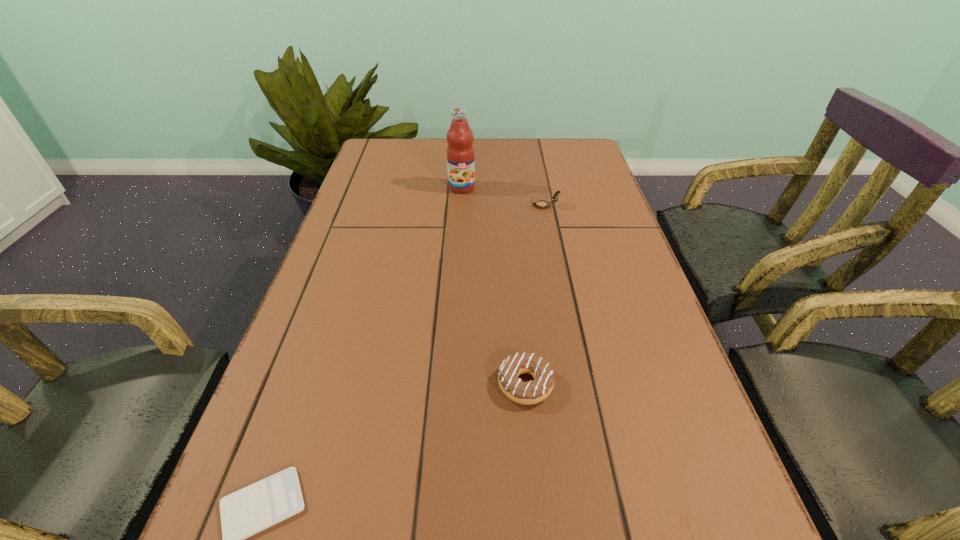
Locate an element on the screen. The image size is (960, 540). blank region between the second object from right to left and the tallest object is located at coordinates (493, 286).

Where is `free space between the tallest object and the second object from right to left`? This screenshot has width=960, height=540. free space between the tallest object and the second object from right to left is located at coordinates (493, 286).

You are a GUI agent. You are given a task and a screenshot of the screen. Output one action in this format:
    pyautogui.click(x=<x>, y=<y>)
    Task: Click on the object that is the second closest one to the farthest object
    The width and height of the screenshot is (960, 540).
    Given the screenshot: What is the action you would take?
    pyautogui.click(x=534, y=391)

Identify which object is the third nearest to the fruit juice. Please provide its 2D coordinates. Your answer should be formatted as a tuple, i.e. [(x, y)], where the tuple contains the x and y coordinates of a point satisfying the conditions above.

[(248, 511)]

The width and height of the screenshot is (960, 540). In order to click on free spot that satisfies the following two spatial constraints: 1. on the face of the compass; 2. on the front side of the third object from left to right in this screenshot , I will do (x=580, y=384).

Where is `vacant region that satisfies the following two spatial constraints: 1. on the front label of the farthest object; 2. on the right side of the second object from right to left`? The width and height of the screenshot is (960, 540). vacant region that satisfies the following two spatial constraints: 1. on the front label of the farthest object; 2. on the right side of the second object from right to left is located at coordinates (x=450, y=384).

This screenshot has width=960, height=540. I want to click on vacant space that satisfies the following two spatial constraints: 1. on the front label of the third object from left to right; 2. on the left side of the second object from left to right, so click(450, 384).